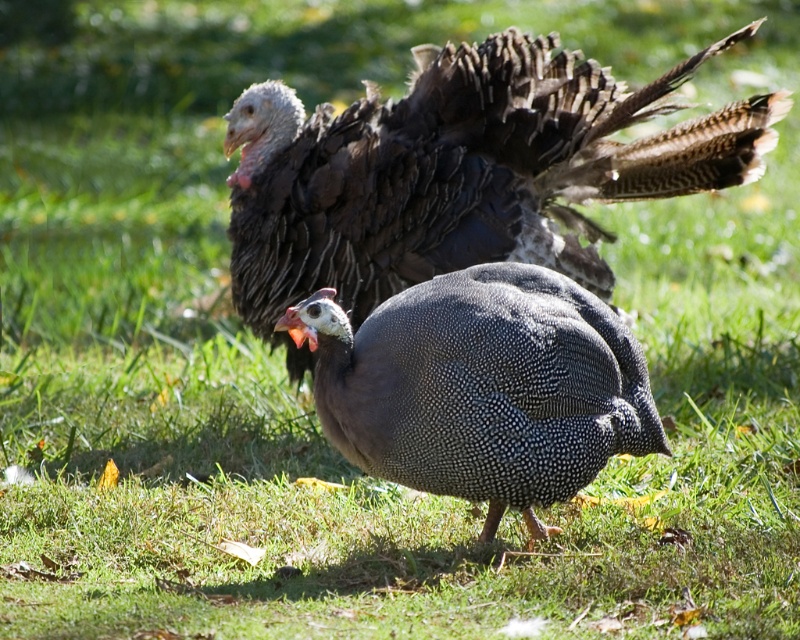
You are a birdwatcher trying to identify the birds in the image. You notice two objects labeled dark brown feathers at upper center and speckled feathered guinea fowl at center. Which one has a greater width?

The dark brown feathers at upper center has a greater width than the speckled feathered guinea fowl at center.

You are a photographer trying to capture both birds in a single shot. Given that the camera can only focus on one point at a time, which point should you choose to ensure both birds are in focus? The points are point A at point (440, 72) and point B at point (376, 316).

You should choose point B at point (376, 316) because it is closer to the photographer than point A at point (440, 72), so focusing on point B will keep both points in focus.